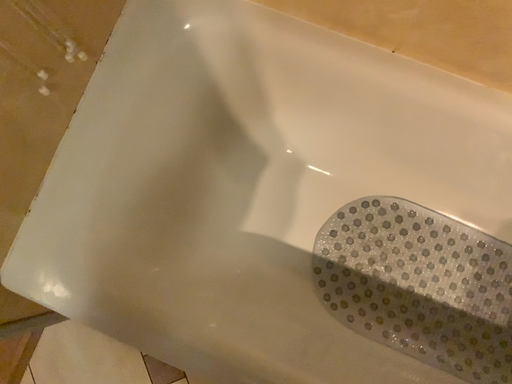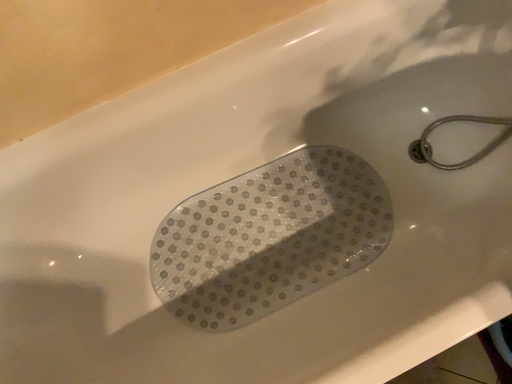
Question: Which way did the camera rotate in the video?

Choices:
 (A) rotated right
 (B) rotated left

Answer: (A)